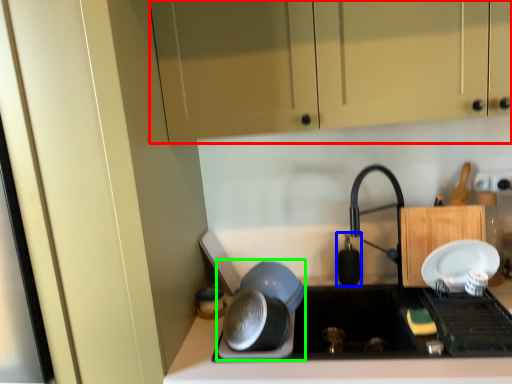
Question: Which is farther away from cabinetry (highlighted by a red box)? appliance (highlighted by a blue box) or appliance (highlighted by a green box)?

Choices:
 (A) appliance
 (B) appliance

Answer: (A)